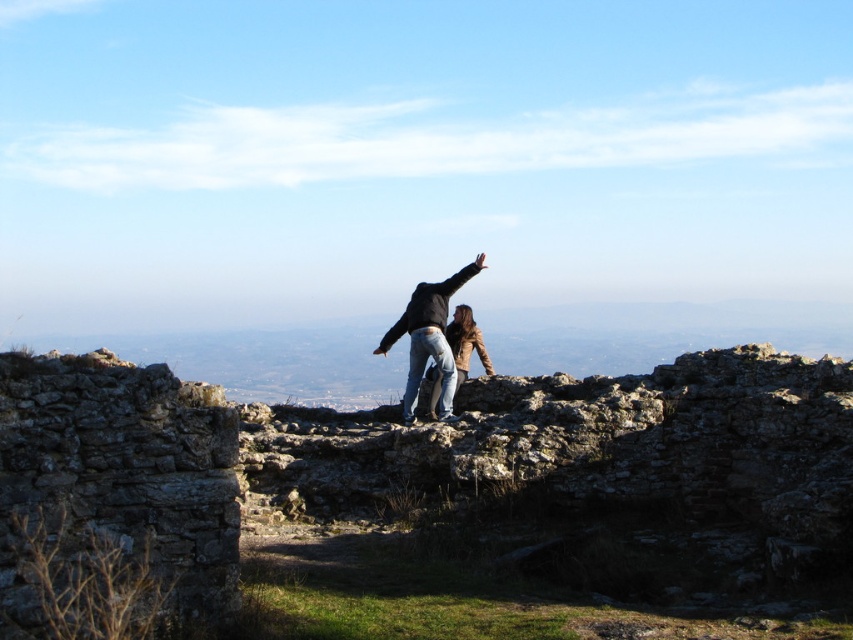
Does rustic stone ruins at center appear on the left side of leather jacket at center?

Yes, rustic stone ruins at center is to the left of leather jacket at center.

At what (x,y) coordinates should I click in order to perform the action: click on rustic stone ruins at center. Please return your answer as a coordinate pair (x, y). This screenshot has width=853, height=640. Looking at the image, I should click on (457, 499).

You are a GUI agent. You are given a task and a screenshot of the screen. Output one action in this format:
    pyautogui.click(x=<x>, y=<y>)
    Task: Click on the rustic stone ruins at center
    
    Given the screenshot: What is the action you would take?
    pyautogui.click(x=457, y=499)

Consider the image. Is jeans at center smaller than leather jacket at center?

Actually, jeans at center might be larger than leather jacket at center.

How far apart are jeans at center and leather jacket at center?

jeans at center is 88.69 centimeters from leather jacket at center.

Identify the location of jeans at center. The width and height of the screenshot is (853, 640). (428, 337).

Is rustic stone ruins at center shorter than jeans at center?

Indeed, rustic stone ruins at center has a lesser height compared to jeans at center.

Is point (735, 525) positioned in front of point (428, 332)?

Yes.

Which is behind, point (741, 460) or point (422, 284)?

Point (422, 284)

Identify the location of rustic stone ruins at center. Image resolution: width=853 pixels, height=640 pixels. (457, 499).